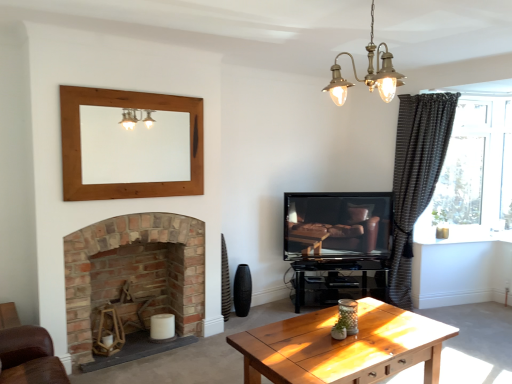
The image size is (512, 384). Find the location of `empty space that is ontop of wooden mirror at upper center (from a real-world perspective)`. empty space that is ontop of wooden mirror at upper center (from a real-world perspective) is located at coordinates (128, 94).